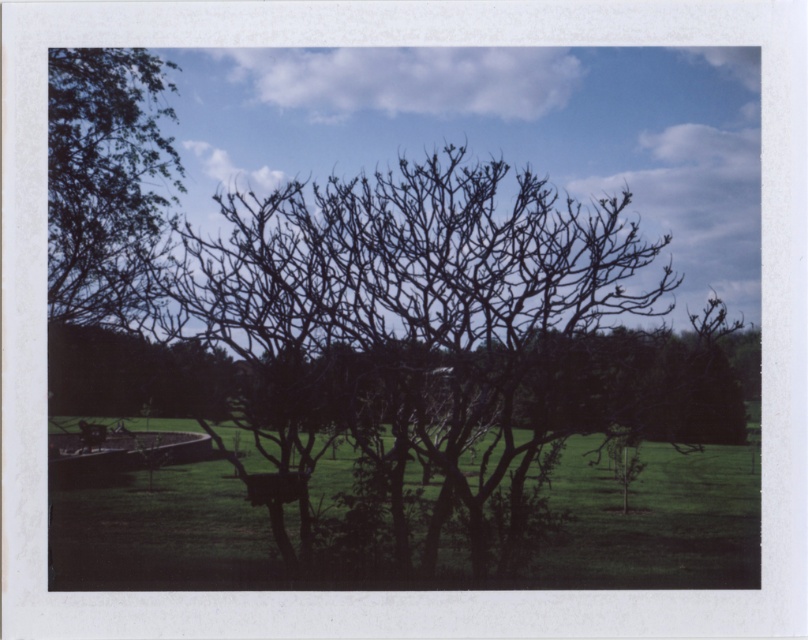
Question: Among these objects, which one is nearest to the camera?

Choices:
 (A) bare branches at center
 (B) green leafy tree at upper left
 (C) green grass at lower left

Answer: (C)

Question: Which object appears farthest from the camera in this image?

Choices:
 (A) bare branches at center
 (B) green leafy tree at upper left

Answer: (B)

Question: Can you confirm if bare branches at center is positioned below green grass at lower left?

Choices:
 (A) no
 (B) yes

Answer: (A)

Question: Is bare branches at center bigger than green leafy tree at upper left?

Choices:
 (A) yes
 (B) no

Answer: (A)

Question: Is bare branches at center further to the viewer compared to green grass at lower left?

Choices:
 (A) no
 (B) yes

Answer: (B)

Question: Among these points, which one is nearest to the camera?

Choices:
 (A) (116, 548)
 (B) (116, 145)
 (C) (505, 170)

Answer: (C)